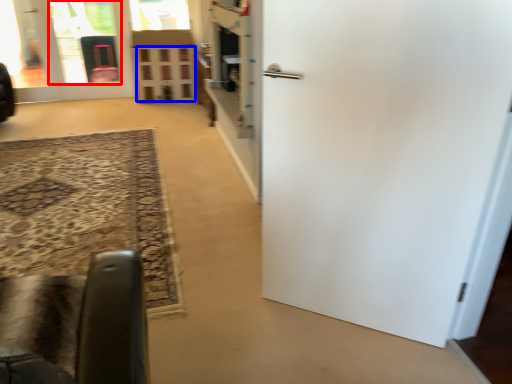
Question: Which object appears closest to the camera in this image, glass door (highlighted by a red box) or window (highlighted by a blue box)?

Choices:
 (A) glass door
 (B) window

Answer: (B)